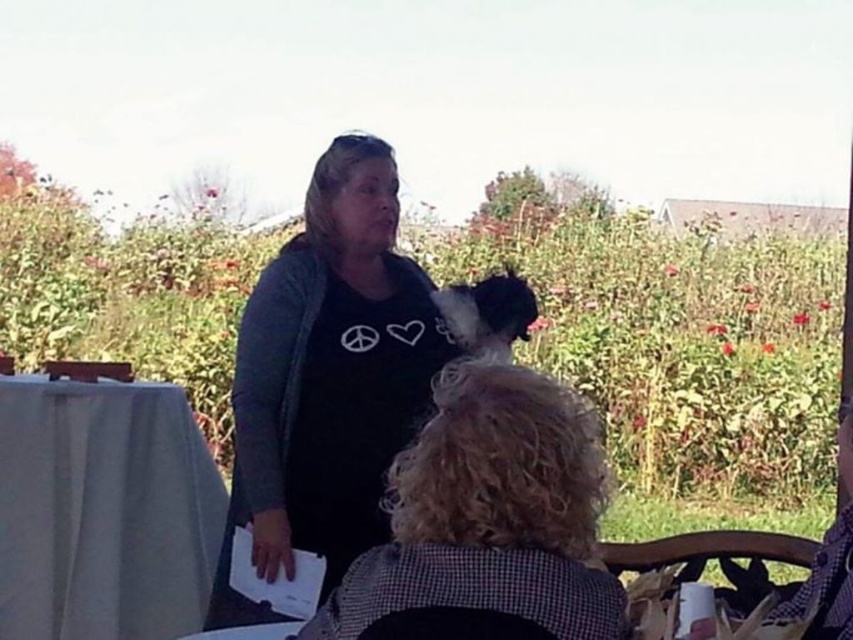
You are a photographer positioned at the scene. You want to take a closeup photo of the black cotton shirt at center without moving any objects. Can you do this while staying in your current position?

The black cotton shirt at center is 1.22 meters from viewer, so yes, you can take a closeup photo of the black cotton shirt at center without moving any objects while staying in your current position as the distance is sufficient for a closeup.

Based on the scene description, can you determine if the black cotton shirt at center is placed on top of or underneath the white cloth at left?

The black cotton shirt at center is positioned over the white cloth at left, so it is placed on top of it.

You are a photographer trying to capture a candid shot of the black matte shirt at center and the white cloth at left. If your camera has a minimum focusing distance of 34 inches, will you be able to take a clear photo of both objects without moving closer?

The distance between the black matte shirt at center and the white cloth at left is 33.81 inches, which is slightly less than the camera minimum focusing distance of 34 inches. Therefore, you will not be able to take a clear photo of both objects without moving closer.